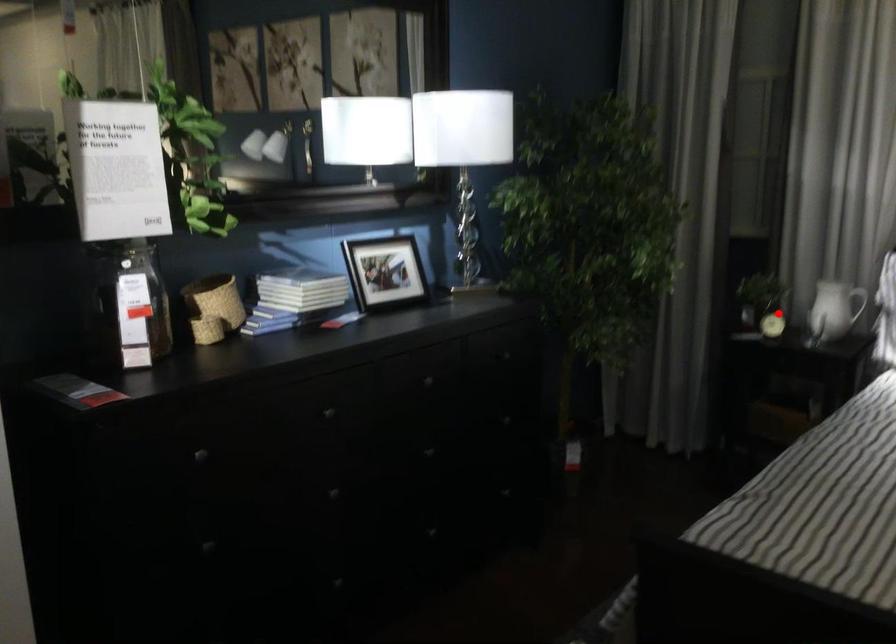
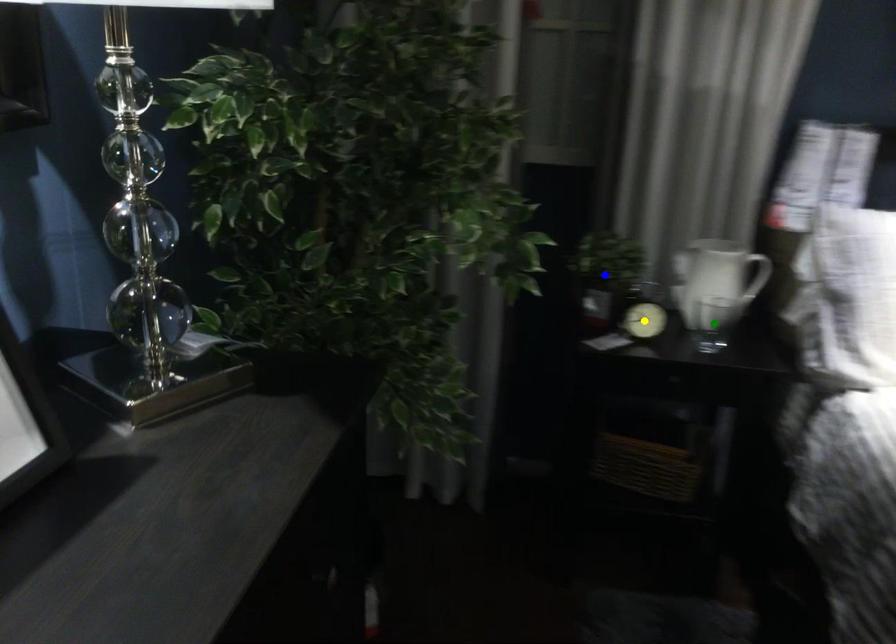
Question: I am providing you with two images of the same scene from different viewpoints. A red point is marked on the first image. You are given multiple points on the second image. In image 2, which mark is for the same physical point as the one in image 1?

Choices:
 (A) blue point
 (B) green point
 (C) yellow point

Answer: (C)